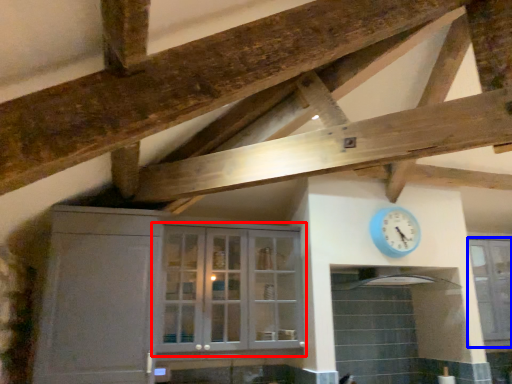
Question: Among these objects, which one is nearest to the camera, cupboard (highlighted by a red box) or window (highlighted by a blue box)?

Choices:
 (A) cupboard
 (B) window

Answer: (A)